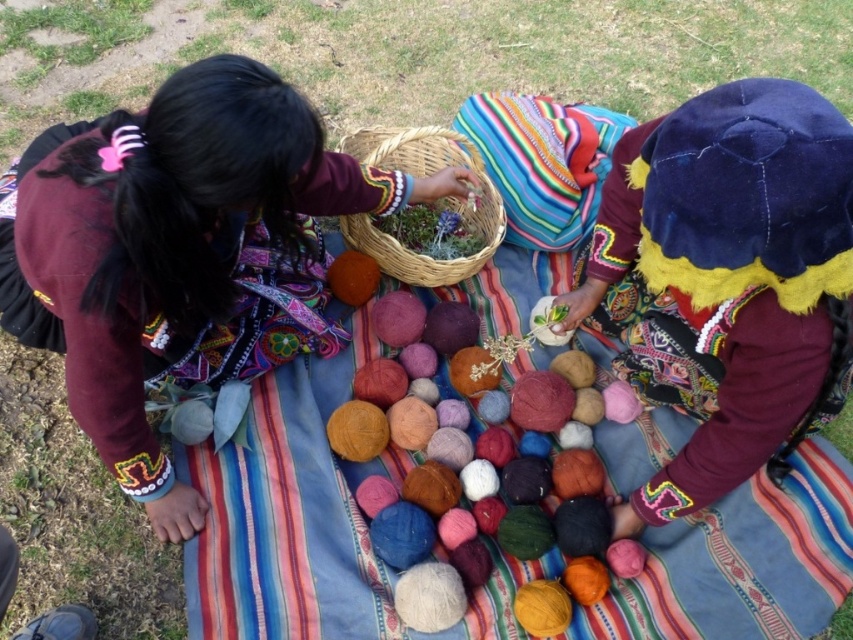
Question: Which point is closer to the camera?

Choices:
 (A) (625, 220)
 (B) (381, 244)
 (C) (12, 230)

Answer: (C)

Question: Estimate the real-world distances between objects in this image. Which object is closer to the velvet blue hat at upper right?

Choices:
 (A) soft wool balls at center
 (B) matte woolen yarn balls at center

Answer: (A)

Question: Based on their relative distances, which object is farther from the matte woolen yarn balls at center?

Choices:
 (A) velvet blue hat at upper right
 (B) soft wool balls at center
 (C) woven natural basket at center

Answer: (A)

Question: Does velvet blue hat at upper right lie in front of woven natural basket at center?

Choices:
 (A) yes
 (B) no

Answer: (A)

Question: Is soft wool balls at center below woven natural basket at center?

Choices:
 (A) no
 (B) yes

Answer: (B)

Question: From the image, what is the correct spatial relationship of matte woolen yarn balls at center in relation to soft wool balls at center?

Choices:
 (A) below
 (B) above

Answer: (B)